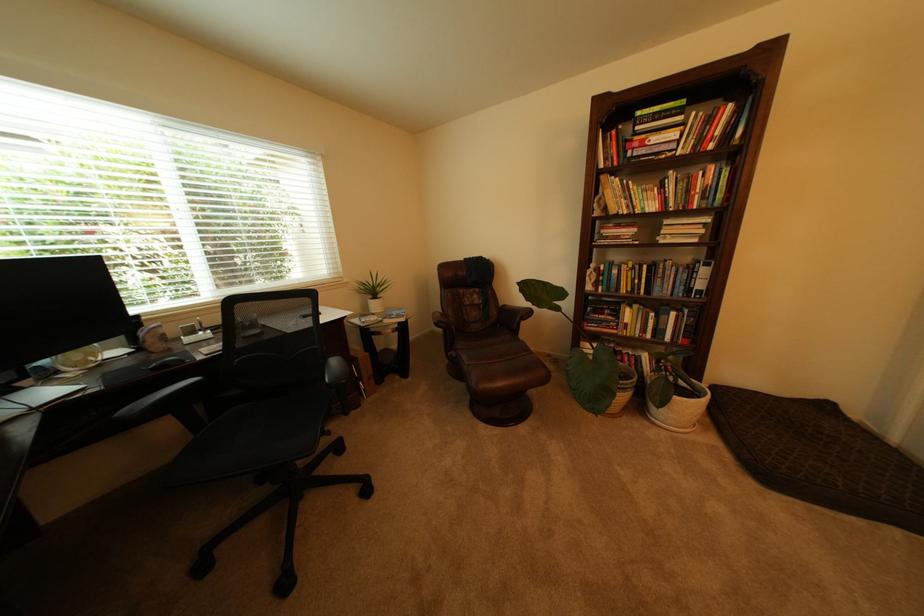
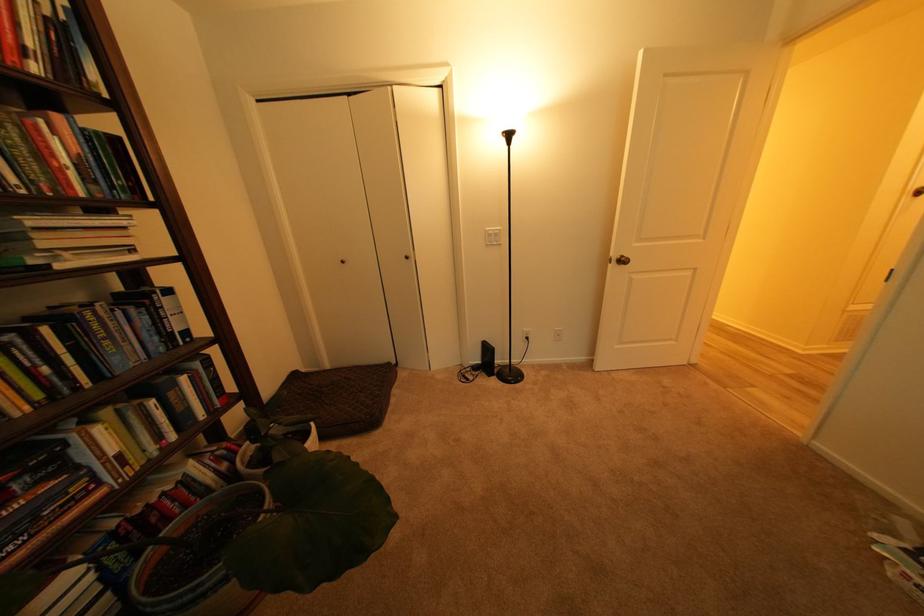
Where in the second image is the point corresponding to (x=689, y=278) from the first image?

(150, 326)